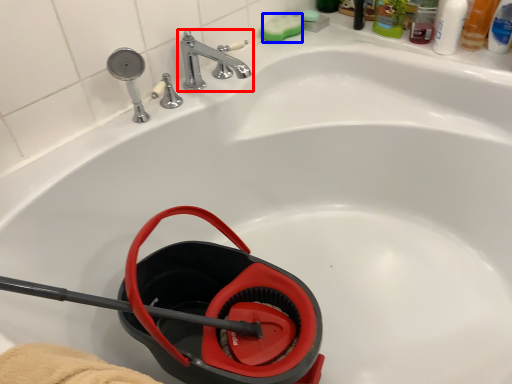
Question: Which point is further to the camera, tap (highlighted by a red box) or soap (highlighted by a blue box)?

Choices:
 (A) tap
 (B) soap

Answer: (B)